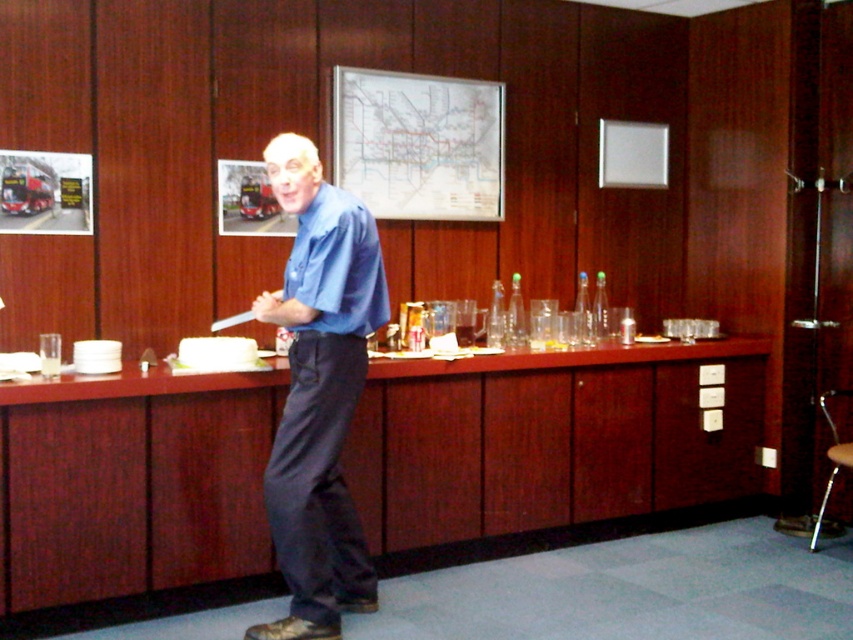
You are standing at the entrance of the room and want to approach the blue smooth shirt at center and the metallic silver stool at lower right. Which object should you walk towards first if you want to reach the one closer to the entrance?

The blue smooth shirt at center is to the left of the metallic silver stool at lower right, so the blue smooth shirt at center is closer to the entrance. You should walk towards the blue smooth shirt at center first.

You are a guest in the conference room and want to sit down. There is a blue smooth shirt at center and a metallic silver stool at lower right. Which object should you approach to sit?

You should approach the metallic silver stool at lower right because the blue smooth shirt at center is in front of it, blocking direct access. The stool is meant for sitting, while the shirt is part of a person standing at the center.